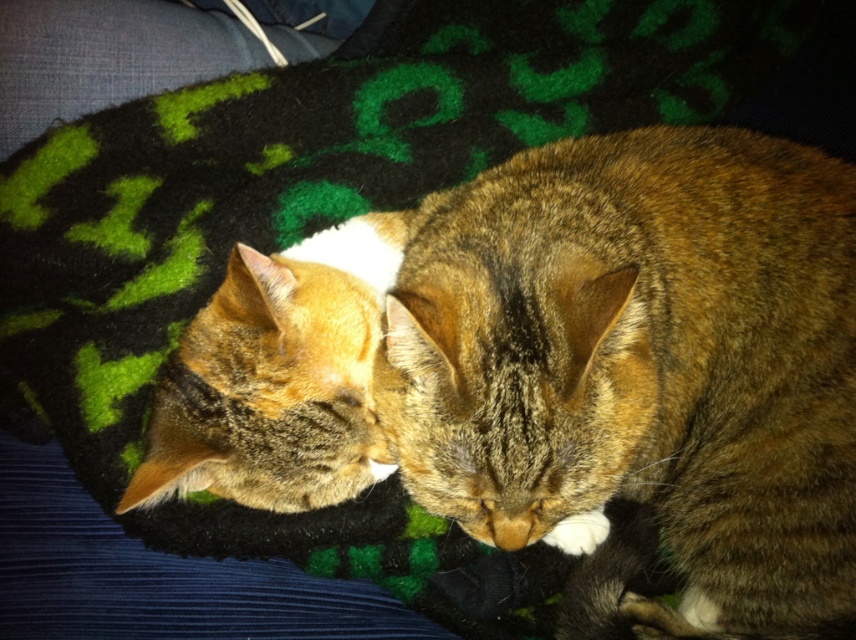
You are standing 1.5 meters away from the blanket where the cats are resting. There is a specific point at coordinates point (x=849, y=337) on the blanket. Can you reach that point without moving closer than 1.2 meters to the blanket?

The distance of point (x=849, y=337) from viewer is 1.24 meters. Since you are currently 1.5 meters away, you can reach it by moving closer to 1.24 meters, which is still within the 1.2 meters limit. Wait, actually 1.24 meters is greater than 1.2 meters, so moving closer would require going to 1.24 meters, which is beyond the 1.2 meters limit. Therefore, you cannot reach it without moving closer than 1.2 meters.

You are a cat owner who wants to buy a new collar for your cats. You see the tabby fur cat at center and the tabby fur cat at left resting on the dark green blanket. Which cat might need a larger collar size based on their size?

The tabby fur cat at center is bigger than the tabby fur cat at left, so it would need a larger collar size.

You are a photographer trying to capture a closeup of the tabby fur cat at center. However, the tabby fur cat at left is blocking your view. Can you adjust your position to take the photo without moving either cat?

The tabby fur cat at center is positioned under the tabby fur cat at left, so you can lower your camera or adjust your angle to photograph the tabby fur cat at center from below the tabby fur cat at left.